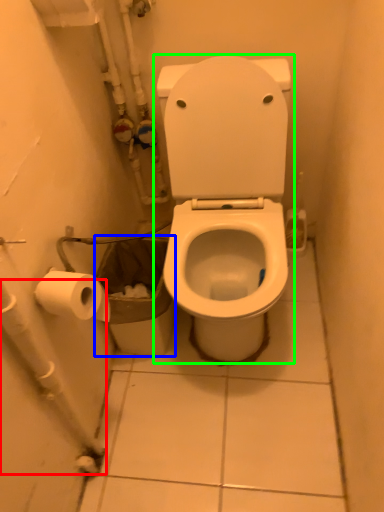
Question: Based on their relative distances, which object is nearer to water pipe (highlighted by a red box)? Choose from garbage (highlighted by a blue box) and toilet (highlighted by a green box).

Choices:
 (A) garbage
 (B) toilet

Answer: (A)